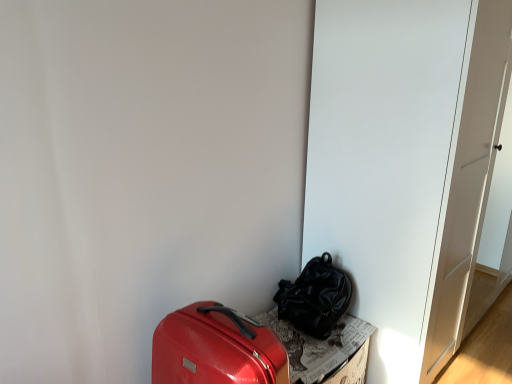
Question: Can you confirm if white matte door at center is taller than shiny red suitcase at lower left, placed as the second luggage and bags when sorted from right to left?

Choices:
 (A) yes
 (B) no

Answer: (A)

Question: Does white matte door at center appear on the right side of shiny red suitcase at lower left, placed as the second luggage and bags when sorted from right to left?

Choices:
 (A) yes
 (B) no

Answer: (A)

Question: From a real-world perspective, is white matte door at center over shiny red suitcase at lower left, arranged as the second luggage and bags when viewed from the back?

Choices:
 (A) no
 (B) yes

Answer: (B)

Question: Can you confirm if white matte door at center is thinner than shiny red suitcase at lower left, the first luggage and bags when ordered from left to right?

Choices:
 (A) yes
 (B) no

Answer: (B)

Question: From the image's perspective, is white matte door at center on top of shiny red suitcase at lower left, the first luggage and bags positioned from the front?

Choices:
 (A) no
 (B) yes

Answer: (B)

Question: Is shiny black backpack at center, acting as the second luggage and bags starting from the left, taller or shorter than white matte door at center?

Choices:
 (A) tall
 (B) short

Answer: (B)

Question: Is shiny black backpack at center, the 1th luggage and bags when ordered from back to front, wider or thinner than white matte door at center?

Choices:
 (A) thin
 (B) wide

Answer: (A)

Question: Considering the positions of point (307, 271) and point (364, 122), is point (307, 271) closer or farther from the camera than point (364, 122)?

Choices:
 (A) farther
 (B) closer

Answer: (A)

Question: From a real-world perspective, relative to white matte door at center, is shiny black backpack at center, acting as the second luggage and bags starting from the left, vertically above or below?

Choices:
 (A) below
 (B) above

Answer: (A)

Question: Considering the positions of white matte door at center and cardboard textured box at lower right in the image, is white matte door at center wider or thinner than cardboard textured box at lower right?

Choices:
 (A) wide
 (B) thin

Answer: (A)

Question: From the image's perspective, relative to cardboard textured box at lower right, is white matte door at center above or below?

Choices:
 (A) below
 (B) above

Answer: (B)

Question: From a real-world perspective, relative to cardboard textured box at lower right, is white matte door at center vertically above or below?

Choices:
 (A) above
 (B) below

Answer: (A)

Question: Considering the relative positions of white matte door at center and cardboard textured box at lower right in the image provided, is white matte door at center to the left or to the right of cardboard textured box at lower right?

Choices:
 (A) left
 (B) right

Answer: (B)

Question: Would you say shiny black backpack at center, the first luggage and bags from the right, is inside or outside shiny red suitcase at lower left, the first luggage and bags positioned from the front?

Choices:
 (A) outside
 (B) inside

Answer: (A)

Question: From the image's perspective, is shiny black backpack at center, the first luggage and bags from the right, above or below shiny red suitcase at lower left, arranged as the second luggage and bags when viewed from the back?

Choices:
 (A) below
 (B) above

Answer: (B)